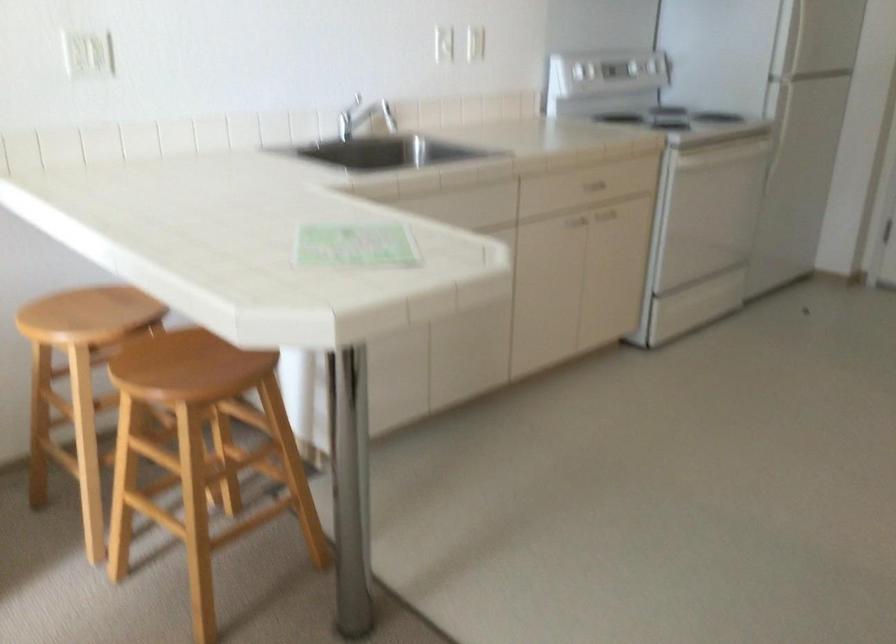
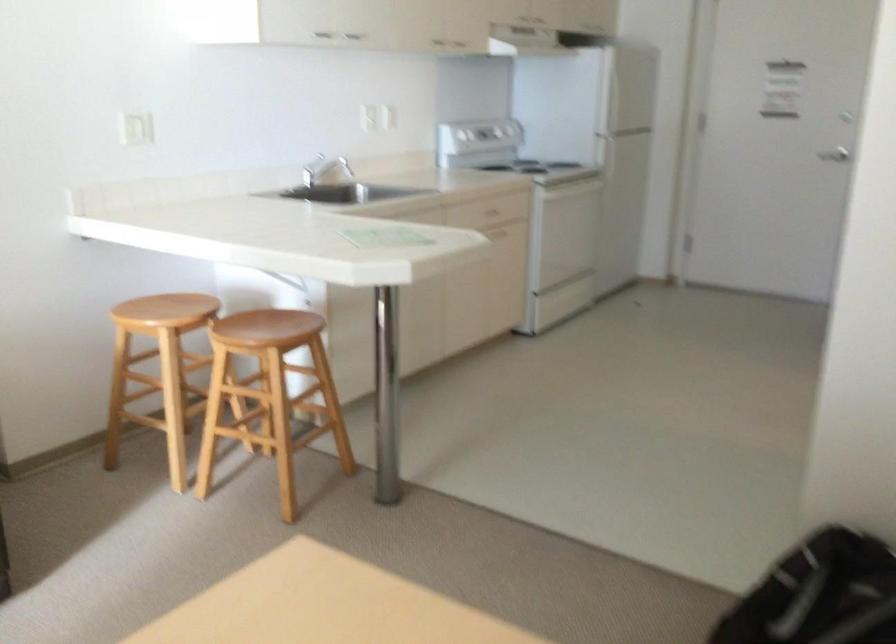
The point at (773, 131) is marked in the first image. Where is the corresponding point in the second image?

(606, 164)